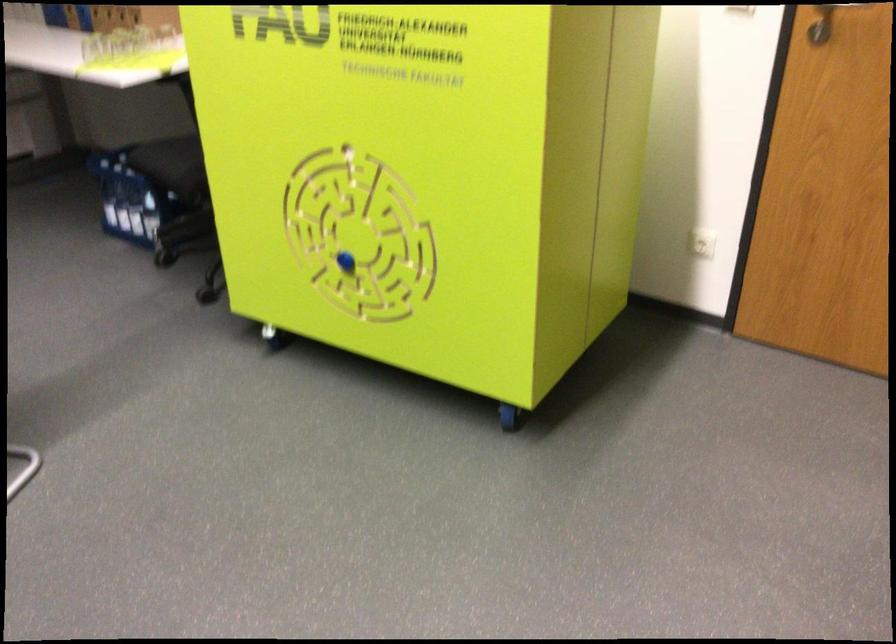
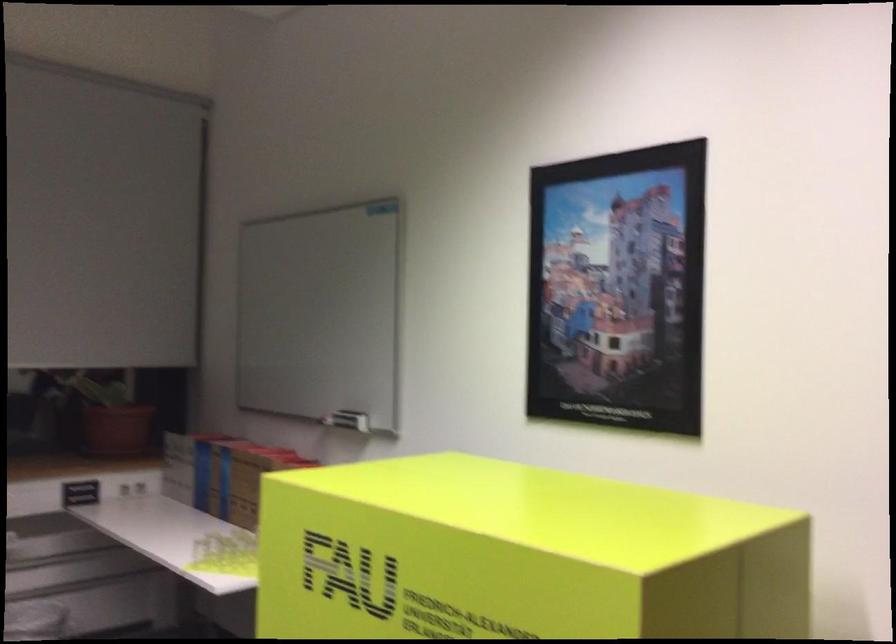
How did the camera likely rotate?

The camera rotated toward left-up.